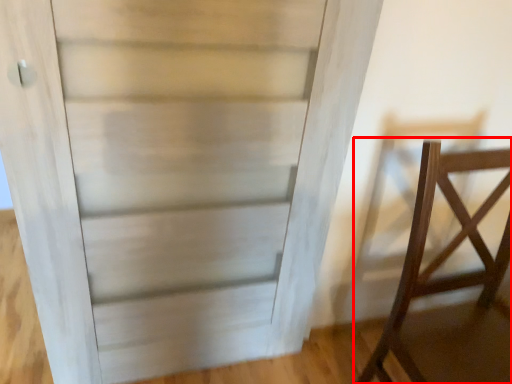
Question: From the image's perspective, where is furniture (annotated by the red box) located in relation to door in the image?

Choices:
 (A) above
 (B) below

Answer: (B)